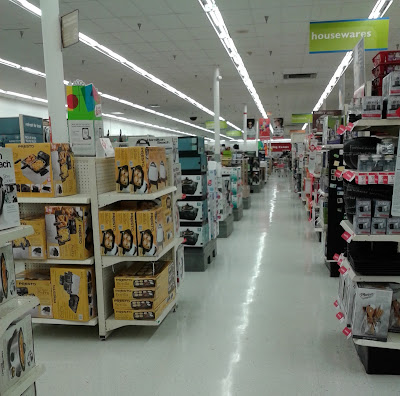
Locate an element on the screen. ceiling tiles in large store is located at coordinates (176, 34), (292, 60), (285, 100), (128, 90), (15, 48), (98, 10), (171, 123).